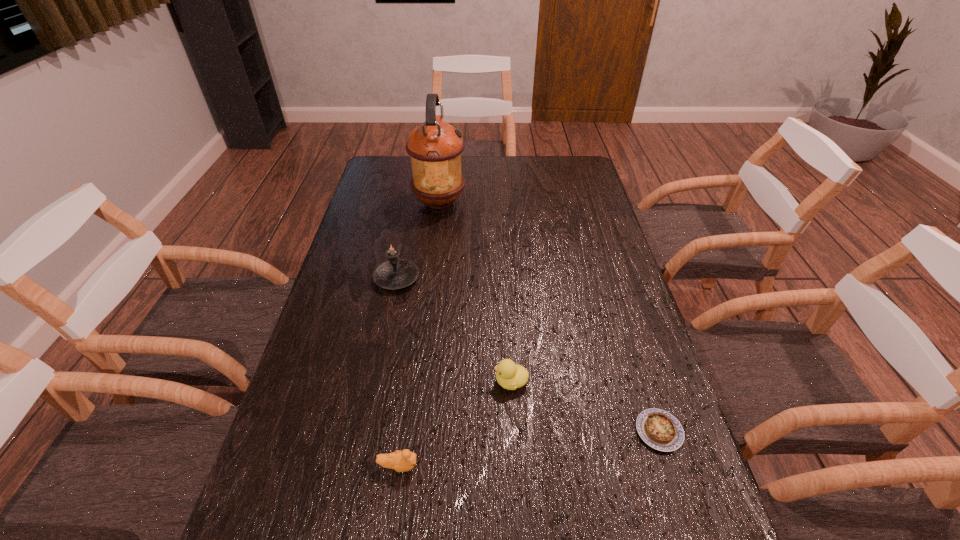
The image size is (960, 540). Identify the location of vacant region between the oil lamp and the quiche. (549, 316).

This screenshot has width=960, height=540. What are the coordinates of `vacant space that is in between the nearer duckling and the fourth nearest object` in the screenshot? It's located at (397, 372).

At what (x,y) coordinates should I click in order to perform the action: click on object that is the second nearest to the left duckling. Please return your answer as a coordinate pair (x, y). Looking at the image, I should click on (659, 429).

Identify the location of object identified as the third closest to the second nearest object. (395, 273).